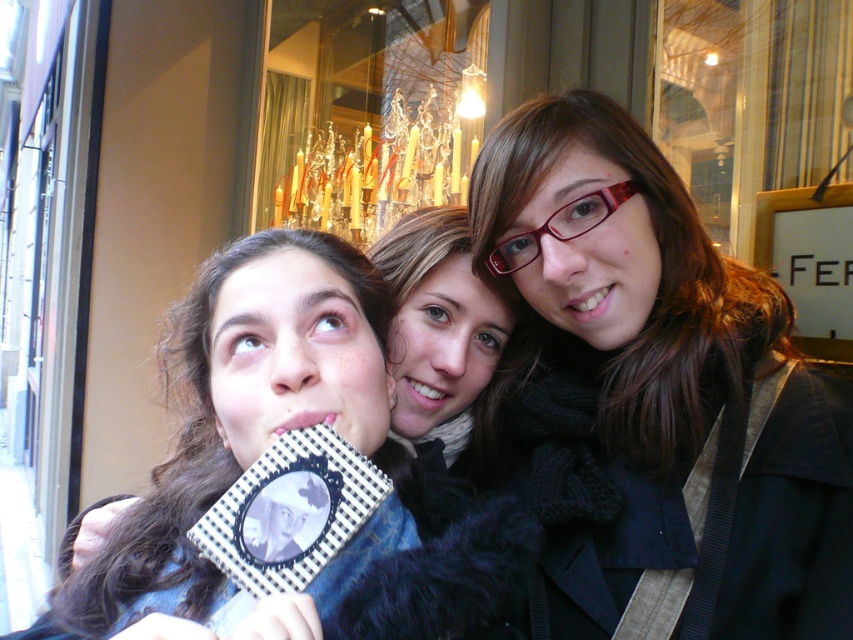
Is the position of matte black scarf at center more distant than that of matte black book at center?

That is True.

Can you confirm if matte black scarf at center is taller than matte black book at center?

Yes.

Is point (708, 422) closer to viewer compared to point (312, 339)?

That is False.

Locate an element on the screen. This screenshot has width=853, height=640. matte black scarf at center is located at coordinates (659, 394).

Does matte black scarf at center have a smaller size compared to crystal chandelier at upper center?

Indeed, matte black scarf at center has a smaller size compared to crystal chandelier at upper center.

Is matte black scarf at center to the right of crystal chandelier at upper center from the viewer's perspective?

Indeed, matte black scarf at center is positioned on the right side of crystal chandelier at upper center.

Measure the distance between point (671, 513) and camera.

They are 84.66 centimeters apart.

The width and height of the screenshot is (853, 640). I want to click on matte black scarf at center, so click(659, 394).

Based on the photo, who is taller, matte black book at center or crystal chandelier at upper center?

crystal chandelier at upper center is taller.

Where is `matte black book at center`? Image resolution: width=853 pixels, height=640 pixels. matte black book at center is located at coordinates (265, 449).